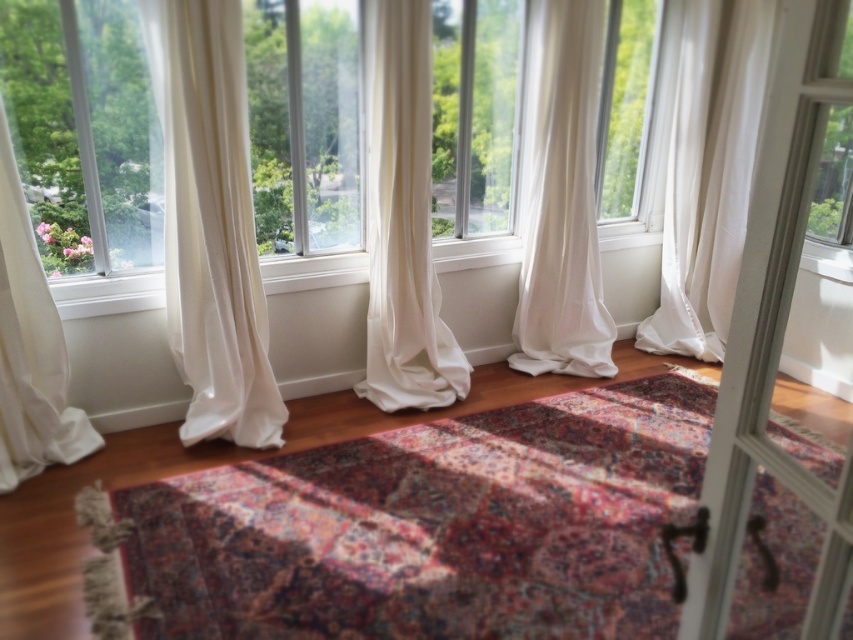
Question: Can you confirm if sheer white curtain at left is positioned above white sheer curtain at center?

Choices:
 (A) yes
 (B) no

Answer: (B)

Question: Which point appears farthest from the camera in this image?

Choices:
 (A) (320, 212)
 (B) (425, 384)
 (C) (12, 369)

Answer: (B)

Question: Is clear glass window at center to the left of white sheer curtain at left from the viewer's perspective?

Choices:
 (A) yes
 (B) no

Answer: (B)

Question: Which point is farther to the camera?

Choices:
 (A) white sheer curtain at center
 (B) white sheer curtain at right
 (C) clear glass window at center

Answer: (B)

Question: Which of these objects is positioned closest to the white sheer curtain at left?

Choices:
 (A) transparent glass window at left
 (B) white sheer curtain at center

Answer: (A)

Question: Is the position of transparent glass window at left less distant than that of white sheer curtain at center?

Choices:
 (A) yes
 (B) no

Answer: (A)